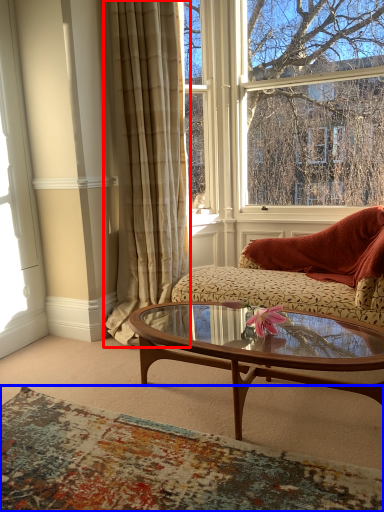
Question: Among these objects, which one is nearest to the camera, curtain (highlighted by a red box) or plain (highlighted by a blue box)?

Choices:
 (A) curtain
 (B) plain

Answer: (B)